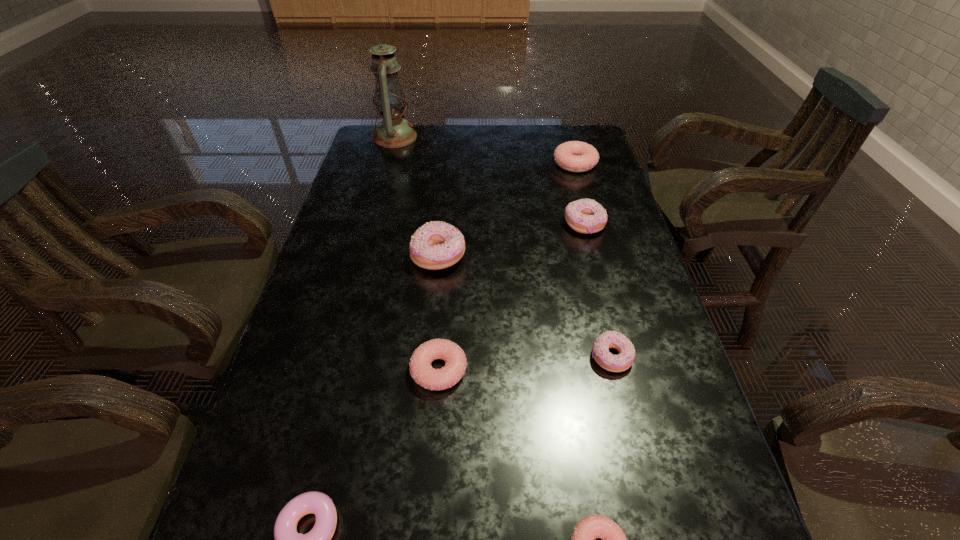
Where is `free area in between the seventh shortest object and the third farthest purple doughnut`? This screenshot has height=540, width=960. free area in between the seventh shortest object and the third farthest purple doughnut is located at coordinates (524, 307).

Select which object is the fifth closest to the tallest object. Please provide its 2D coordinates. Your answer should be formatted as a tuple, i.e. [(x, y)], where the tuple contains the x and y coordinates of a point satisfying the conditions above.

[(610, 339)]

Choose which object is the third nearest neighbor to the third smallest purple doughnut. Please provide its 2D coordinates. Your answer should be formatted as a tuple, i.e. [(x, y)], where the tuple contains the x and y coordinates of a point satisfying the conditions above.

[(610, 339)]

Locate an element on the screen. The width and height of the screenshot is (960, 540). doughnut that is the fourth closest one to the leftmost purple doughnut is located at coordinates (436, 245).

Identify which doughnut is the sixth nearest to the shortest doughnut. Please provide its 2D coordinates. Your answer should be formatted as a tuple, i.e. [(x, y)], where the tuple contains the x and y coordinates of a point satisfying the conditions above.

[(574, 156)]

Find the location of `the third closest purple doughnut to the leftmost purple doughnut`. the third closest purple doughnut to the leftmost purple doughnut is located at coordinates (586, 216).

Identify the location of purple doughnut that stands as the third closest to the leftmost pink doughnut. (x=610, y=339).

Identify which pink doughnut is located as the nearest to the farthest doughnut. Please provide its 2D coordinates. Your answer should be formatted as a tuple, i.e. [(x, y)], where the tuple contains the x and y coordinates of a point satisfying the conditions above.

[(421, 371)]

The image size is (960, 540). I want to click on pink doughnut that is the third closest one to the leftmost doughnut, so click(x=574, y=156).

This screenshot has width=960, height=540. In order to click on vacant space that satisfies the following two spatial constraints: 1. on the back side of the farthest pink doughnut; 2. on the right side of the second tallest object in this screenshot , I will do `click(447, 164)`.